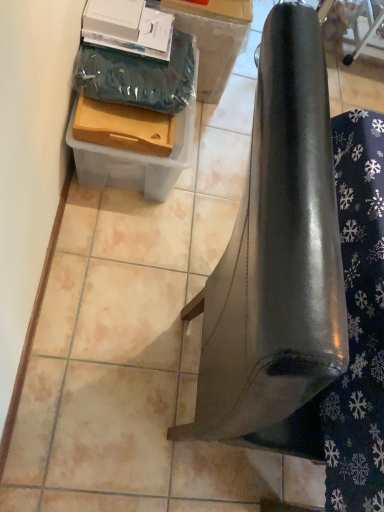
The height and width of the screenshot is (512, 384). I want to click on free space to the right of matte plastic box at upper left, the first cardboard box from the bottom, so click(x=198, y=212).